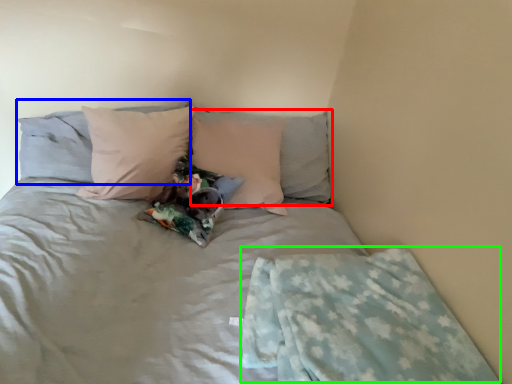
Question: Based on their relative distances, which object is farther from pillow (highlighted by a red box)? Choose from pillow (highlighted by a blue box) and blanket (highlighted by a green box).

Choices:
 (A) pillow
 (B) blanket

Answer: (B)